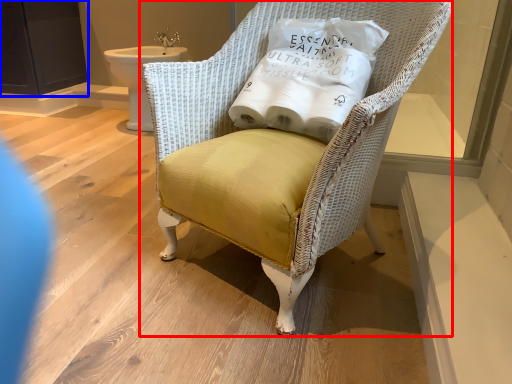
Question: Which object appears closest to the camera in this image, chair (highlighted by a red box) or screen door (highlighted by a blue box)?

Choices:
 (A) chair
 (B) screen door

Answer: (A)